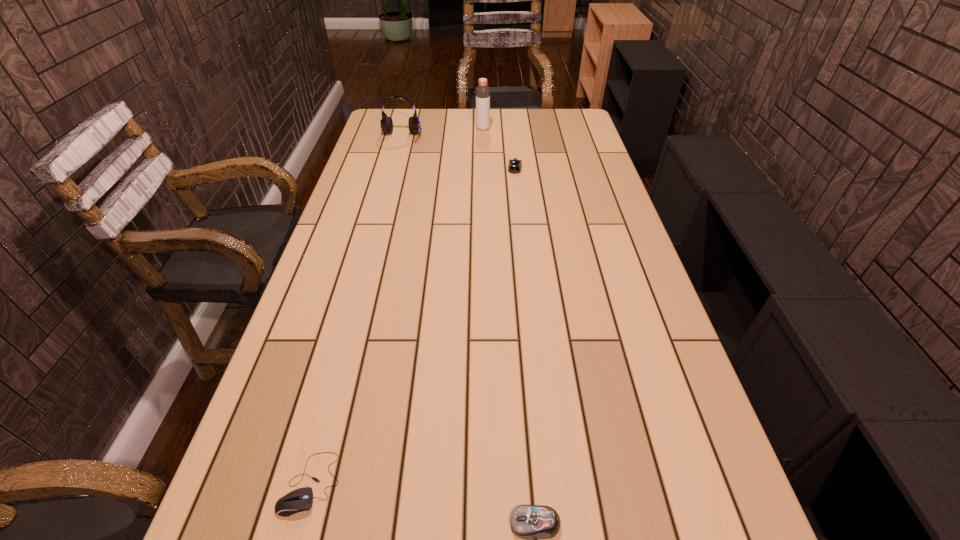
Find the location of a particular element. vacant space that satisfies the following two spatial constraints: 1. on the front side of the tallest object; 2. on the right side of the third nearest object is located at coordinates (483, 168).

Locate an element on the screen. The height and width of the screenshot is (540, 960). free space that satisfies the following two spatial constraints: 1. on the ear cushions of the leftmost computer mouse; 2. on the right side of the fourth shortest object is located at coordinates (306, 483).